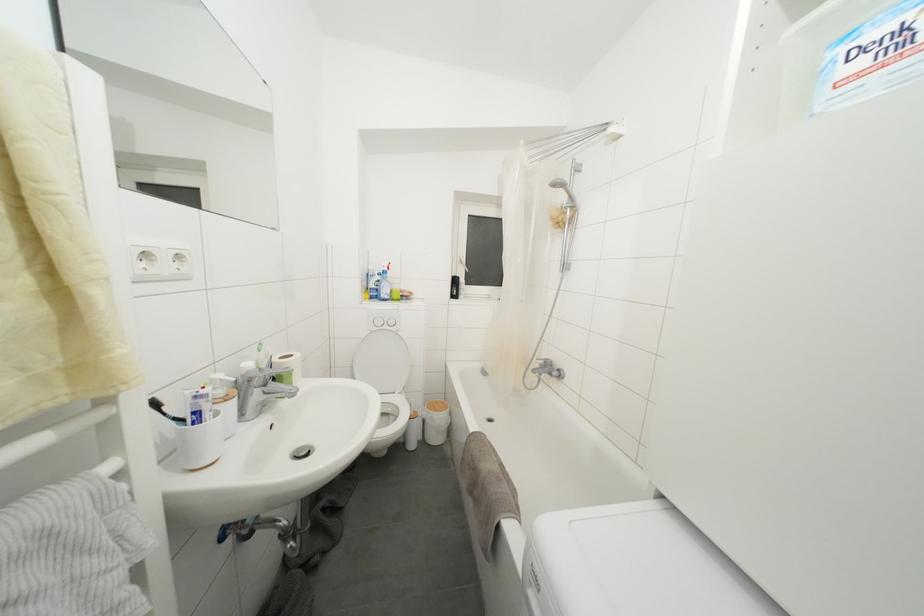
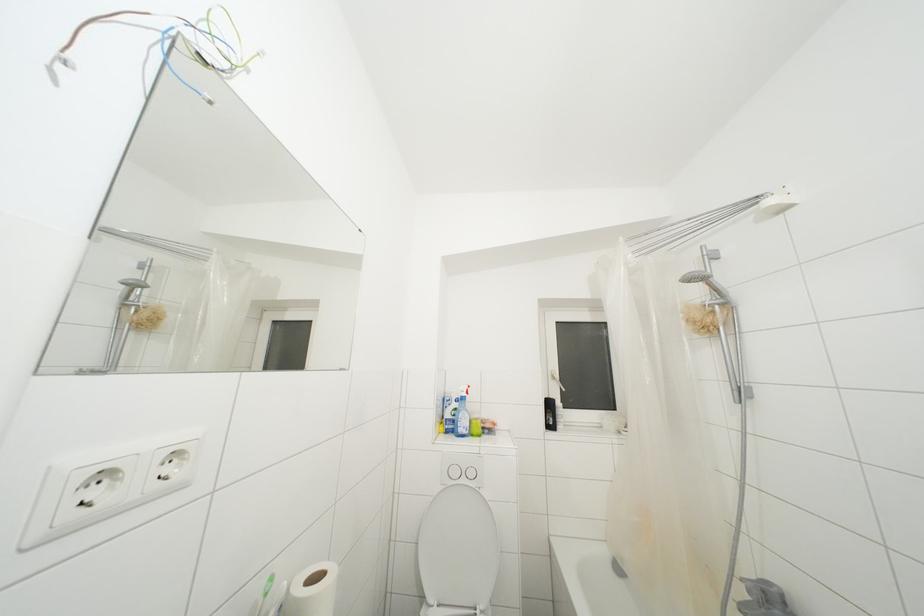
In a continuous first-person perspective shot, in which direction is the camera moving?

The cameraman moved toward left, forward.